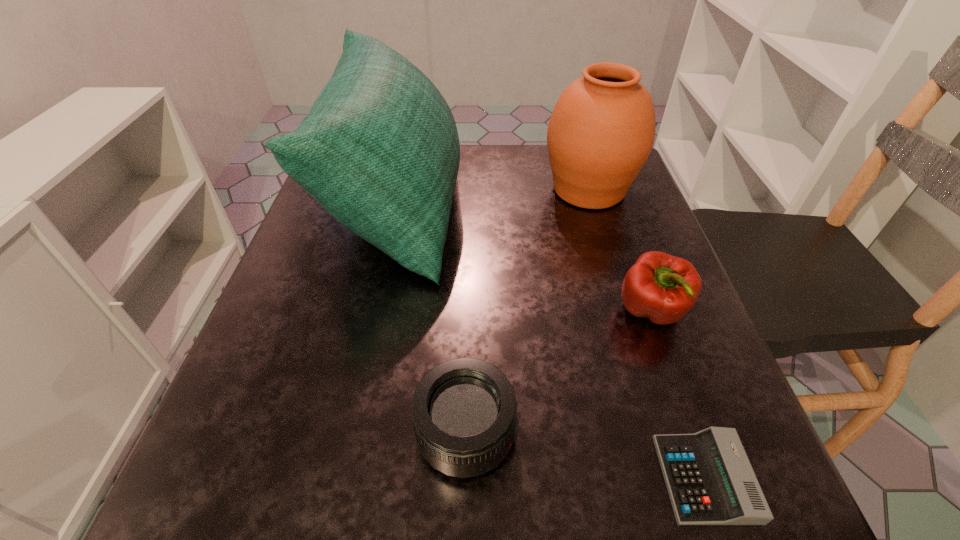
The height and width of the screenshot is (540, 960). I want to click on cushion at the far edge, so click(379, 150).

This screenshot has width=960, height=540. I want to click on urn that is at the far edge, so click(601, 131).

At what (x,y) coordinates should I click in order to perform the action: click on telephoto lens that is at the near edge. Please return your answer as a coordinate pair (x, y). Image resolution: width=960 pixels, height=540 pixels. Looking at the image, I should click on (464, 410).

Locate an element on the screen. Image resolution: width=960 pixels, height=540 pixels. calculator positioned at the near edge is located at coordinates (710, 481).

Locate an element on the screen. The image size is (960, 540). object that is at the left edge is located at coordinates (379, 150).

Find the location of a particular element. This screenshot has height=540, width=960. urn at the right edge is located at coordinates (601, 131).

Where is `bell pepper that is positioned at the right edge`? This screenshot has width=960, height=540. bell pepper that is positioned at the right edge is located at coordinates (663, 288).

Find the location of a particular element. The width and height of the screenshot is (960, 540). calculator at the right edge is located at coordinates (710, 481).

This screenshot has width=960, height=540. I want to click on object present at the far left corner, so click(x=379, y=150).

Where is `object situated at the far right corner`? object situated at the far right corner is located at coordinates click(601, 131).